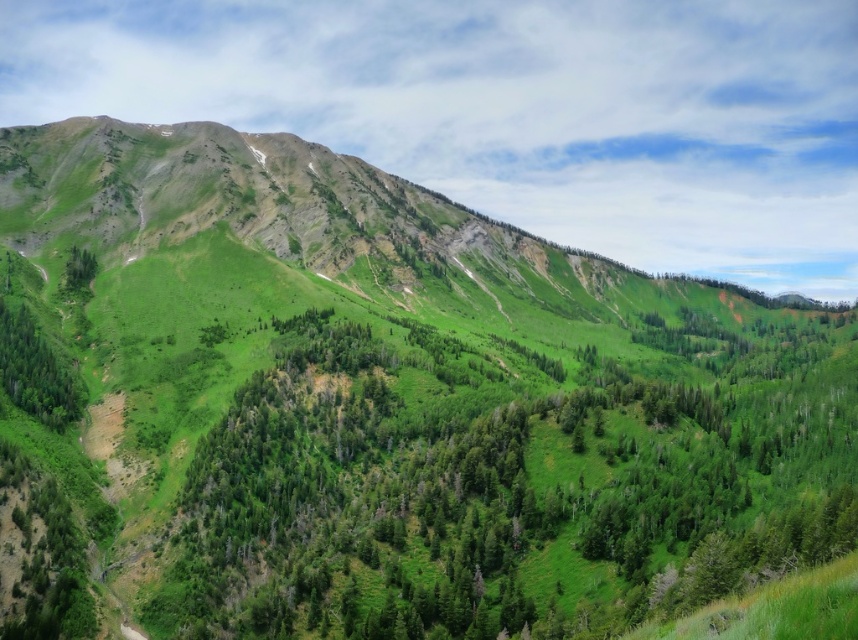
From the picture: You are a hiker standing at the base of the mountain and see the green leafy trees at center and the green leafy tree at upper left. Which tree is closer to your left side?

The green leafy tree at upper left is closer to your left side because the green leafy trees at center is positioned on the right side of it.

You are standing in the mountain landscape and want to take a photo of both the green leafy tree at lower left and the green leafy tree at upper left. Which tree should you focus on first to ensure both are in sharp focus?

You should focus on the green leafy tree at lower left first because it is closer to the viewer. By focusing on the closer tree, the farther tree at upper left will also be in focus due to the depth of field extending beyond the focal point.